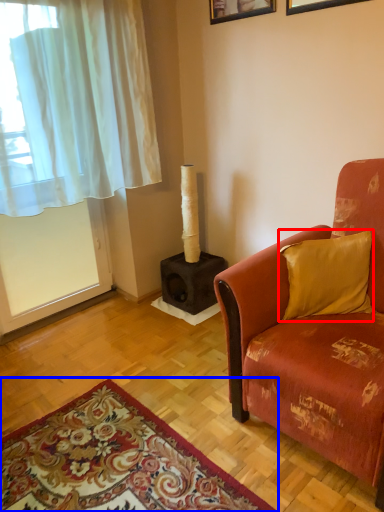
Question: Which of the following is the closest to the observer, pillow (highlighted by a red box) or mat (highlighted by a blue box)?

Choices:
 (A) pillow
 (B) mat

Answer: (B)